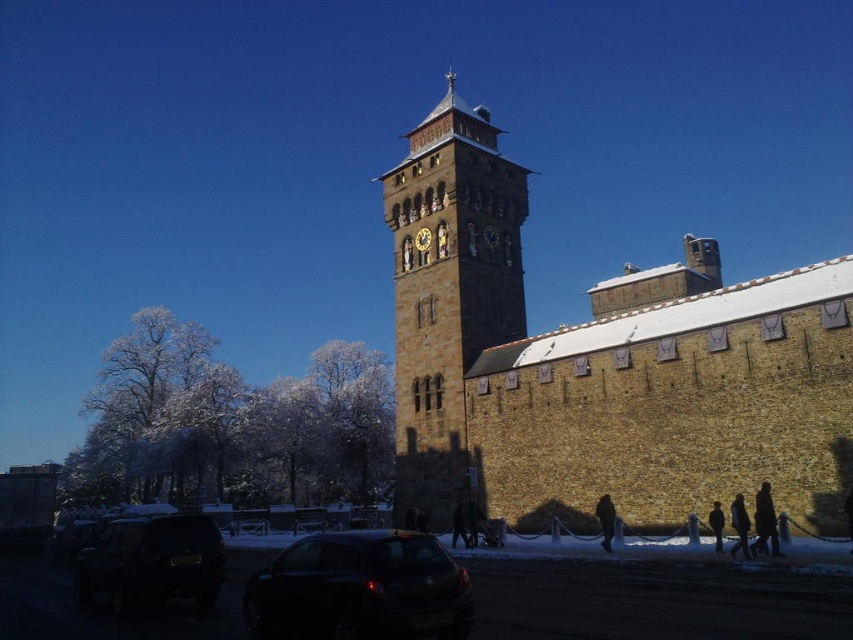
Looking at this image, you are a tourist standing at the parking area and want to take a photo of the brown stone clock tower at center and the black wool coat at lower right. Which object should you focus on first if you want to capture both in one frame without moving the camera?

You should focus on the brown stone clock tower at center first because it is larger and more prominent than the black wool coat at lower right, ensuring it fits well in the frame while still including the smaller coat in the background.

You are standing in the parking area and want to take a photo of the brown stone clock tower at center without any people blocking the view. Since the black wool coat at lower right is in the way, can you move to the left or right to avoid it?

The brown stone clock tower at center is positioned over the black wool coat at lower right, so moving to the left or right might still keep the tower visible while avoiding the coat. However, since the tower is above the coat in the image, moving slightly to either side could position the coat out of the frame while keeping the tower centered.

You are a photographer trying to capture both the dark brown leather coat at lower right and the black fuzzy coat at lower right in a single frame. Given that your camera has a limited field of view, which coat should you position closer to the center to ensure both are fully visible?

Since the dark brown leather coat at lower right is wider than the black fuzzy coat at lower right, you should position the dark brown leather coat at lower right closer to the center to accommodate its larger width within the camera frame.